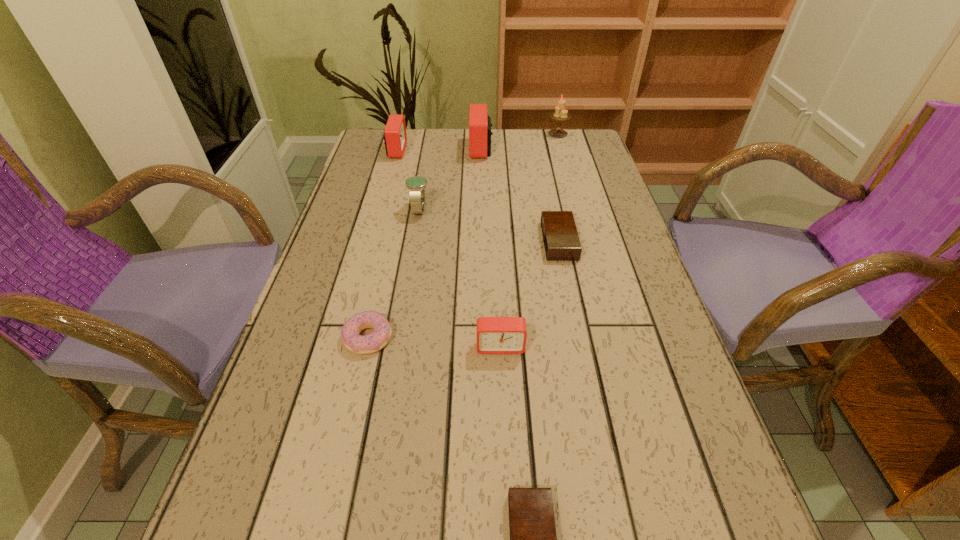
Where is `doughnut`? doughnut is located at coordinates (361, 344).

Locate an element on the screen. The image size is (960, 540). vacant region located 0.050m on the right of the candle holder is located at coordinates (583, 134).

Locate an element on the screen. This screenshot has width=960, height=540. vacant space located on the front-facing side of the tallest alarm clock is located at coordinates (450, 148).

Where is `free space located on the front-facing side of the tallest alarm clock`? free space located on the front-facing side of the tallest alarm clock is located at coordinates (369, 148).

Find the location of a particular element. Image resolution: width=960 pixels, height=540 pixels. free space located 0.250m on the front-facing side of the tallest alarm clock is located at coordinates (391, 148).

The width and height of the screenshot is (960, 540). Find the location of `vacant space located 0.250m on the front-facing side of the fourth shortest alarm clock`. vacant space located 0.250m on the front-facing side of the fourth shortest alarm clock is located at coordinates click(485, 150).

The height and width of the screenshot is (540, 960). Find the location of `vacant area situated 0.110m on the front of the watch`. vacant area situated 0.110m on the front of the watch is located at coordinates (413, 248).

This screenshot has width=960, height=540. What are the coordinates of `vacant space situated on the front-facing side of the nearest red alarm clock` in the screenshot? It's located at (503, 420).

Image resolution: width=960 pixels, height=540 pixels. In order to click on vacant region located on the front face of the right black alarm clock in this screenshot , I will do `click(452, 241)`.

At what (x,y) coordinates should I click in order to perform the action: click on vacant space situated on the front face of the right black alarm clock. Please return your answer as a coordinate pair (x, y). The image size is (960, 540). Looking at the image, I should click on (473, 241).